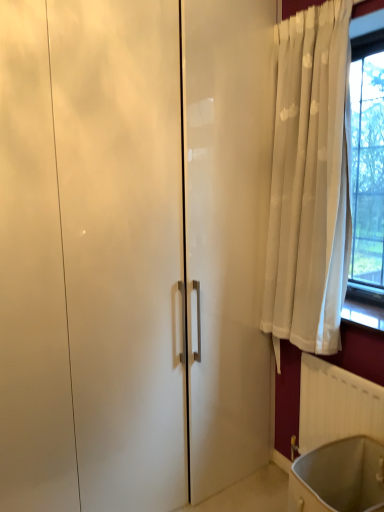
At what (x,y) coordinates should I click in order to perform the action: click on white plastic radiator at lower right. Please return your answer as a coordinate pair (x, y). The width and height of the screenshot is (384, 512). Looking at the image, I should click on (336, 405).

This screenshot has height=512, width=384. What do you see at coordinates (336, 405) in the screenshot?
I see `white plastic radiator at lower right` at bounding box center [336, 405].

In order to face matte white bath at lower right, should I rotate leftwards or rightwards?

A 20.178 degree turn to the right will do.

This screenshot has height=512, width=384. In order to click on matte white bath at lower right in this screenshot , I will do `click(339, 477)`.

This screenshot has height=512, width=384. Describe the element at coordinates (339, 477) in the screenshot. I see `matte white bath at lower right` at that location.

You are a GUI agent. You are given a task and a screenshot of the screen. Output one action in this format:
    pyautogui.click(x=<x>, y=<y>)
    Task: Click on the white plastic radiator at lower right
    The width and height of the screenshot is (384, 512).
    Given the screenshot: What is the action you would take?
    pyautogui.click(x=336, y=405)

Is white plastic radiator at lower right at the right side of matte white bath at lower right?

Indeed, white plastic radiator at lower right is positioned on the right side of matte white bath at lower right.

Considering their positions, is white plastic radiator at lower right located in front of or behind matte white bath at lower right?

Visually, white plastic radiator at lower right is located behind matte white bath at lower right.

Which point is more forward, [319,399] or [333,459]?

The point [333,459] is more forward.

From the image's perspective, is white plastic radiator at lower right located above matte white bath at lower right?

Yes, from the image's perspective, white plastic radiator at lower right is over matte white bath at lower right.

From a real-world perspective, is white plastic radiator at lower right located beneath matte white bath at lower right?

No, from a real-world perspective, white plastic radiator at lower right is not beneath matte white bath at lower right.

Considering the sizes of objects white plastic radiator at lower right and matte white bath at lower right in the image provided, who is thinner, white plastic radiator at lower right or matte white bath at lower right?

With smaller width is white plastic radiator at lower right.

Who is shorter, white plastic radiator at lower right or matte white bath at lower right?

Standing shorter between the two is matte white bath at lower right.

Which of these two, white plastic radiator at lower right or matte white bath at lower right, is smaller?

white plastic radiator at lower right is smaller.

Is white plastic radiator at lower right completely or partially outside of matte white bath at lower right?

Yes, white plastic radiator at lower right is not within matte white bath at lower right.

Looking at this image, is white plastic radiator at lower right far from matte white bath at lower right?

Actually, white plastic radiator at lower right and matte white bath at lower right are a little close together.

Consider the image. Could you tell me if white plastic radiator at lower right is turned towards matte white bath at lower right?

Yes, white plastic radiator at lower right is turned towards matte white bath at lower right.

How different are the orientations of white plastic radiator at lower right and matte white bath at lower right in degrees?

0.886 degrees separate the facing orientations of white plastic radiator at lower right and matte white bath at lower right.

At what (x,y) coordinates should I click in order to perform the action: click on bath in front of the white plastic radiator at lower right. Please return your answer as a coordinate pair (x, y). Looking at the image, I should click on (339, 477).

Considering the relative positions of matte white bath at lower right and white plastic radiator at lower right in the image provided, is matte white bath at lower right to the left of white plastic radiator at lower right from the viewer's perspective?

Indeed, matte white bath at lower right is positioned on the left side of white plastic radiator at lower right.

Is the position of matte white bath at lower right less distant than that of white plastic radiator at lower right?

Yes, matte white bath at lower right is closer to the viewer.

Which point is more distant from viewer, (326,462) or (378,404)?

The point (326,462) is behind.

From the image's perspective, would you say matte white bath at lower right is positioned over white plastic radiator at lower right?

Incorrect, from the image's perspective, matte white bath at lower right is lower than white plastic radiator at lower right.

From a real-world perspective, between matte white bath at lower right and white plastic radiator at lower right, who is vertically higher?

white plastic radiator at lower right.

Which object is thinner, matte white bath at lower right or white plastic radiator at lower right?

Thinner between the two is white plastic radiator at lower right.

Which of these two, matte white bath at lower right or white plastic radiator at lower right, stands shorter?

matte white bath at lower right is shorter.

Which of these two, matte white bath at lower right or white plastic radiator at lower right, is bigger?

matte white bath at lower right is bigger.

Which is correct: matte white bath at lower right is inside white plastic radiator at lower right, or outside of it?

matte white bath at lower right is spatially situated outside white plastic radiator at lower right.

Is matte white bath at lower right touching white plastic radiator at lower right?

They are not placed beside each other.

Could you tell me if matte white bath at lower right is turned towards white plastic radiator at lower right?

No, matte white bath at lower right is not aimed at white plastic radiator at lower right.

Where is `radiator above the matte white bath at lower right (from the image's perspective)`? This screenshot has width=384, height=512. radiator above the matte white bath at lower right (from the image's perspective) is located at coordinates (336, 405).

The height and width of the screenshot is (512, 384). What are the coordinates of `radiator above the matte white bath at lower right (from the image's perspective)` in the screenshot? It's located at (336, 405).

Identify the location of radiator that is behind the matte white bath at lower right. (336, 405).